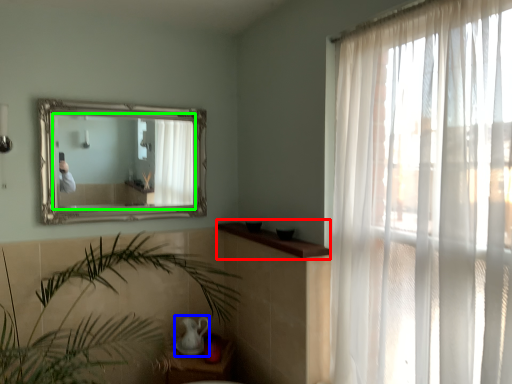
Question: Which object is positioned closest to window sill (highlighted by a red box)? Select from tea pot (highlighted by a blue box) and mirror (highlighted by a green box).

Choices:
 (A) tea pot
 (B) mirror

Answer: (A)